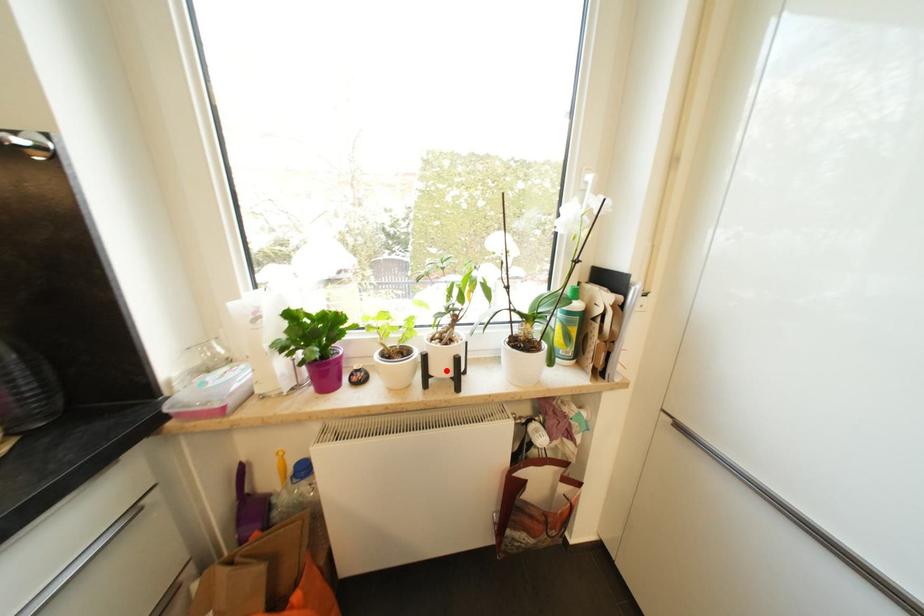
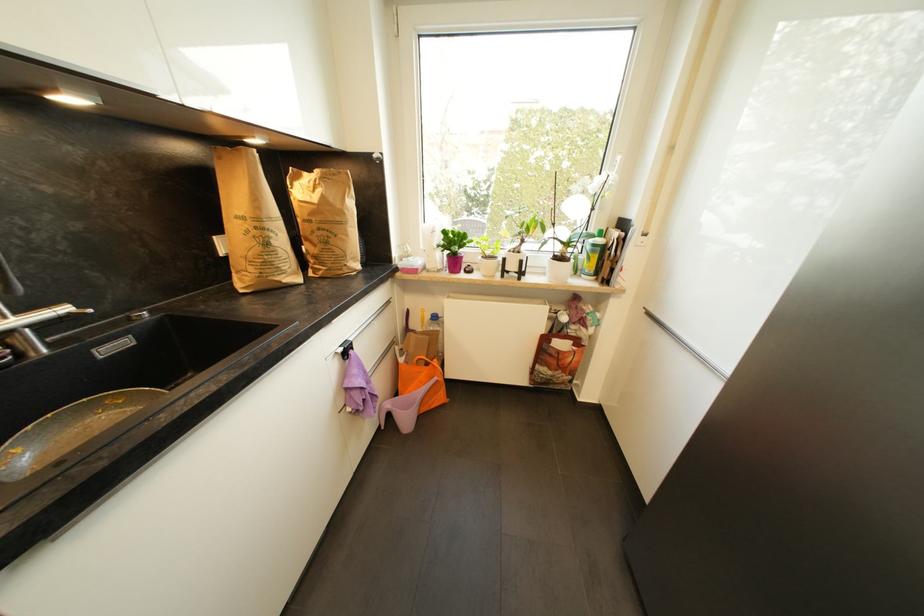
Locate, in the second image, the point that corresponds to the highlighted location in the first image.

(517, 268)